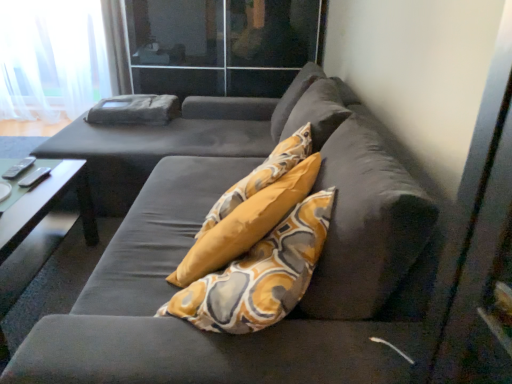
What is the approximate width of green glossy table at lower left?

It is 20.25 inches.

Describe the element at coordinates (220, 45) in the screenshot. I see `transparent glass door at upper center` at that location.

This screenshot has height=384, width=512. Describe the element at coordinates (193, 242) in the screenshot. I see `velvet dark gray couch at center` at that location.

The width and height of the screenshot is (512, 384). Describe the element at coordinates (51, 58) in the screenshot. I see `white sheer curtain at upper left` at that location.

This screenshot has height=384, width=512. In order to click on green glossy table at lower left in this screenshot , I will do `click(39, 227)`.

Based on the photo, does velvet dark gray couch at center appear on the left side of white sheer curtain at upper left?

In fact, velvet dark gray couch at center is to the right of white sheer curtain at upper left.

Does velvet dark gray couch at center have a lesser width compared to white sheer curtain at upper left?

In fact, velvet dark gray couch at center might be wider than white sheer curtain at upper left.

Is velvet dark gray couch at center turned away from white sheer curtain at upper left?

No, velvet dark gray couch at center is not facing away from white sheer curtain at upper left.

Is point (367, 217) closer to camera compared to point (82, 89)?

Yes, it is.

How different are the orientations of white sheer curtain at upper left and green glossy table at lower left in degrees?

white sheer curtain at upper left and green glossy table at lower left are facing 89.6 degrees away from each other.

Can you see white sheer curtain at upper left touching green glossy table at lower left?

No, white sheer curtain at upper left is not making contact with green glossy table at lower left.

Between white sheer curtain at upper left and green glossy table at lower left, which one has smaller size?

green glossy table at lower left is smaller.

From a real-world perspective, is white sheer curtain at upper left positioned above or below green glossy table at lower left?

white sheer curtain at upper left is situated higher than green glossy table at lower left in the real world.

From the image's perspective, between green glossy table at lower left and transparent glass door at upper center, which one is located above?

transparent glass door at upper center, from the image's perspective.

Consider the image. Would you say green glossy table at lower left is to the left or to the right of transparent glass door at upper center in the picture?

In the image, green glossy table at lower left appears on the left side of transparent glass door at upper center.

Does point (21, 188) come farther from viewer compared to point (304, 56)?

No.

I want to click on glass door above the white sheer curtain at upper left (from a real-world perspective), so click(220, 45).

Is white sheer curtain at upper left positioned far away from transparent glass door at upper center?

Yes, white sheer curtain at upper left and transparent glass door at upper center are quite far apart.

Which of these two, white sheer curtain at upper left or transparent glass door at upper center, stands shorter?

Standing shorter between the two is transparent glass door at upper center.

Is white sheer curtain at upper left situated inside transparent glass door at upper center or outside?

The correct answer is: outside.

Looking at the image, does green glossy table at lower left seem bigger or smaller compared to velvet dark gray couch at center?

green glossy table at lower left is smaller than velvet dark gray couch at center.

Is green glossy table at lower left far from velvet dark gray couch at center?

green glossy table at lower left is actually quite close to velvet dark gray couch at center.

Would you say velvet dark gray couch at center is part of green glossy table at lower left's contents?

No, velvet dark gray couch at center is not inside green glossy table at lower left.

Between point (44, 231) and point (343, 164), which one is positioned behind?

The point (44, 231) is farther.

Who is smaller, velvet dark gray couch at center or green glossy table at lower left?

With smaller size is green glossy table at lower left.

Image resolution: width=512 pixels, height=384 pixels. Identify the location of studio couch to the right of green glossy table at lower left. (x=193, y=242).

From a real-world perspective, relative to green glossy table at lower left, is velvet dark gray couch at center vertically above or below?

From a real-world perspective, velvet dark gray couch at center is physically above green glossy table at lower left.

Is green glossy table at lower left surrounding white sheer curtain at upper left?

No.

From the image's perspective, between green glossy table at lower left and white sheer curtain at upper left, who is located below?

From the image's view, green glossy table at lower left is below.

Which of these two, green glossy table at lower left or white sheer curtain at upper left, stands taller?

white sheer curtain at upper left.

Can you confirm if green glossy table at lower left is thinner than white sheer curtain at upper left?

No.

You are a GUI agent. You are given a task and a screenshot of the screen. Output one action in this format:
    pyautogui.click(x=<x>, y=<y>)
    Task: Click on the curtain lying above the velvet dark gray couch at center (from the image's perspective)
    The image size is (512, 384).
    Given the screenshot: What is the action you would take?
    pyautogui.click(x=51, y=58)

This screenshot has width=512, height=384. Find the location of `curtain that appears above the green glossy table at lower left (from a real-world perspective)`. curtain that appears above the green glossy table at lower left (from a real-world perspective) is located at coordinates (51, 58).

Which object lies further to the anchor point white sheer curtain at upper left, green glossy table at lower left or transparent glass door at upper center?

Based on the image, green glossy table at lower left appears to be further to white sheer curtain at upper left.

From the picture: Estimate the real-world distances between objects in this image. Which object is closer to velvet dark gray couch at center, transparent glass door at upper center or green glossy table at lower left?

Based on the image, green glossy table at lower left appears to be nearer to velvet dark gray couch at center.

Which object lies nearer to the anchor point velvet dark gray couch at center, transparent glass door at upper center or white sheer curtain at upper left?

Based on the image, transparent glass door at upper center appears to be nearer to velvet dark gray couch at center.

From the image, which object appears to be farther from velvet dark gray couch at center, white sheer curtain at upper left or green glossy table at lower left?

white sheer curtain at upper left.

When comparing their distances from white sheer curtain at upper left, does velvet dark gray couch at center or transparent glass door at upper center seem closer?

transparent glass door at upper center is closer to white sheer curtain at upper left.

Considering their positions, is velvet dark gray couch at center positioned closer to green glossy table at lower left than white sheer curtain at upper left?

The object closer to green glossy table at lower left is velvet dark gray couch at center.

From the image, which object appears to be nearer to green glossy table at lower left, white sheer curtain at upper left or transparent glass door at upper center?

Among the two, transparent glass door at upper center is located nearer to green glossy table at lower left.

From the image, which object appears to be nearer to velvet dark gray couch at center, green glossy table at lower left or transparent glass door at upper center?

green glossy table at lower left lies closer to velvet dark gray couch at center than the other object.

Locate an element on the screen. This screenshot has width=512, height=384. glass door between green glossy table at lower left and white sheer curtain at upper left in the front-back direction is located at coordinates (220, 45).

Find the location of a particular element. table located between velvet dark gray couch at center and transparent glass door at upper center in the depth direction is located at coordinates (39, 227).

Where is `glass door positioned between velvet dark gray couch at center and white sheer curtain at upper left from near to far`? The width and height of the screenshot is (512, 384). glass door positioned between velvet dark gray couch at center and white sheer curtain at upper left from near to far is located at coordinates pos(220,45).

At what (x,y) coordinates should I click in order to perform the action: click on table between velvet dark gray couch at center and white sheer curtain at upper left in the front-back direction. Please return your answer as a coordinate pair (x, y). Looking at the image, I should click on (39, 227).